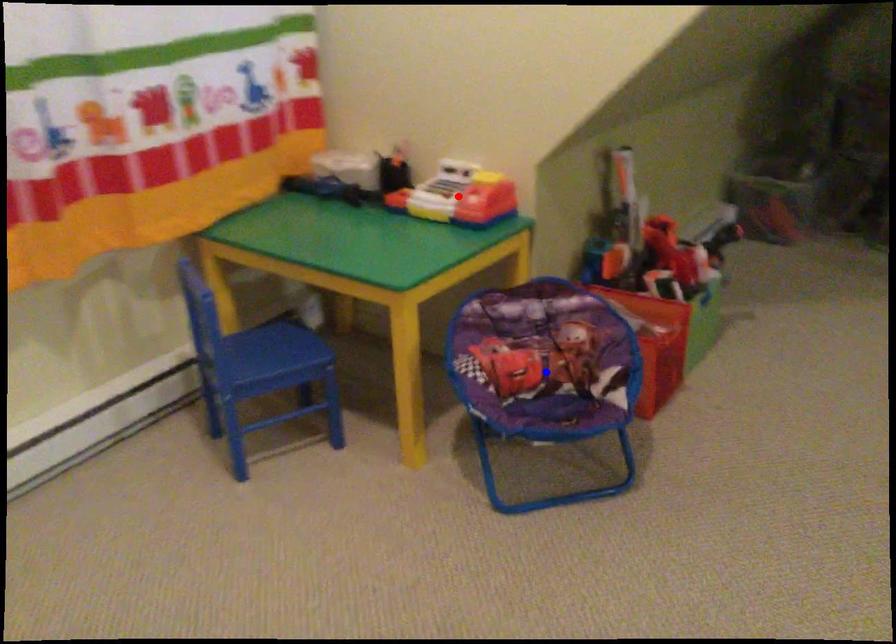
Question: In the image, two points are highlighted. Which point is nearer to the camera? Reply with the corresponding letter.

Choices:
 (A) blue point
 (B) red point

Answer: (A)